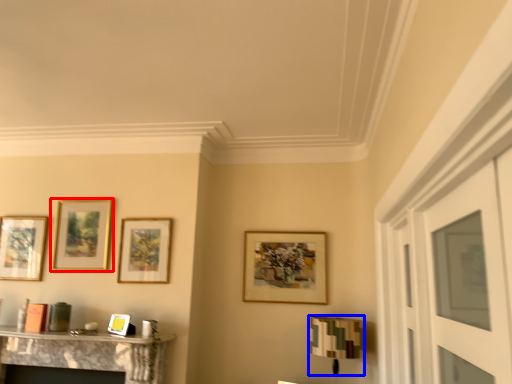
Question: Which object is closer to the camera taking this photo, picture frame (highlighted by a red box) or lamp (highlighted by a blue box)?

Choices:
 (A) picture frame
 (B) lamp

Answer: (B)